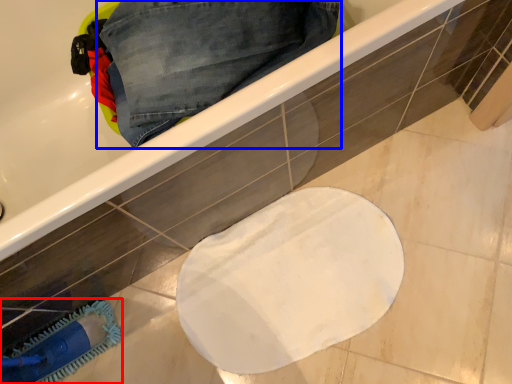
Question: Which object appears closest to the camera in this image, brush (highlighted by a red box) or trousers (highlighted by a blue box)?

Choices:
 (A) brush
 (B) trousers

Answer: (B)